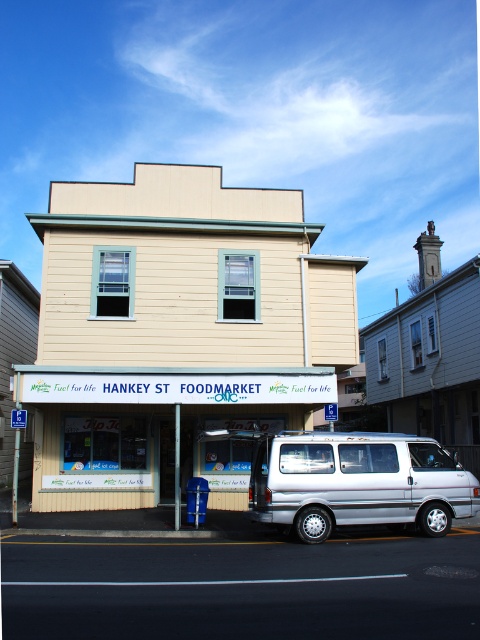
You are a delivery person with a cart that is 2 meters wide. You need to move your cart between the beige wood hankey st foodmarket at center and the silver metallic van at center. Is there enough space for your cart to pass through?

The distance between the beige wood hankey st foodmarket at center and the silver metallic van at center is 3.41 meters. Since the cart is 2 meters wide, there is sufficient space for the cart to pass through.

You are a delivery person arriving at Hankey Street Foodmarket. You see the beige wood hankey st foodmarket at center and the silver metallic van at center. Which object is taller?

The beige wood hankey st foodmarket at center is much taller than the silver metallic van at center.

In the scene shown: You are standing at the entrance of Hankey Street Foodmarket. You see a point marked at coordinates (175, 330). What object is located at that point?

The point at coordinates (175, 330) corresponds to the beige wood Hankey St Foodmarket at center.